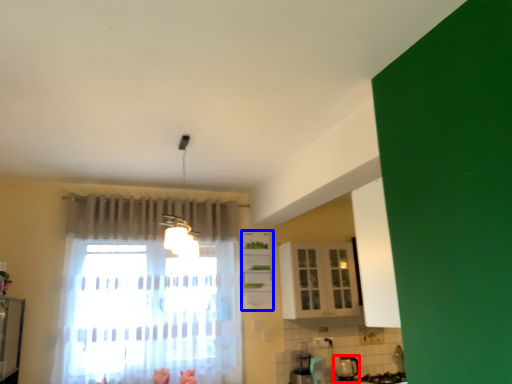
Question: Which object is further to the camera taking this photo, appliance (highlighted by a red box) or cabinetry (highlighted by a blue box)?

Choices:
 (A) appliance
 (B) cabinetry

Answer: (B)